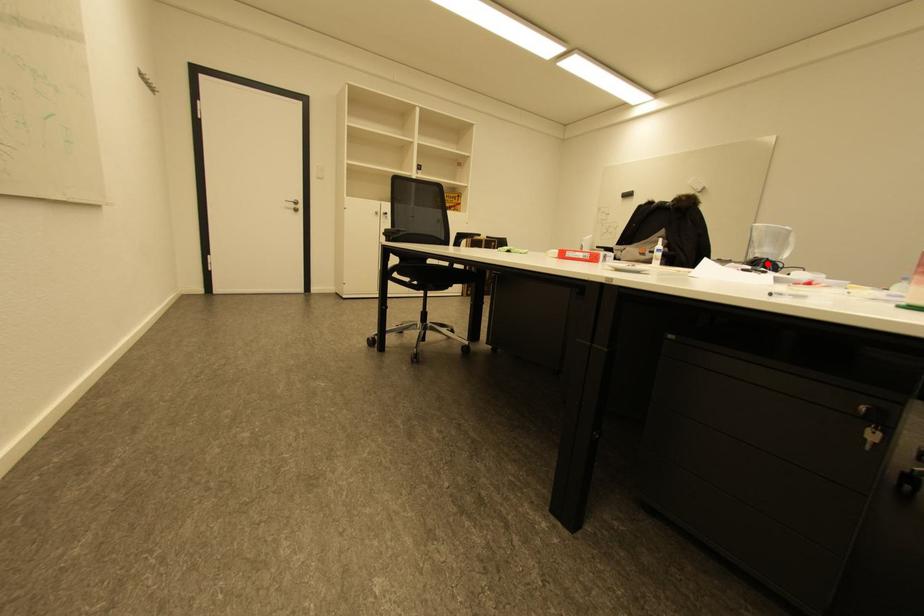
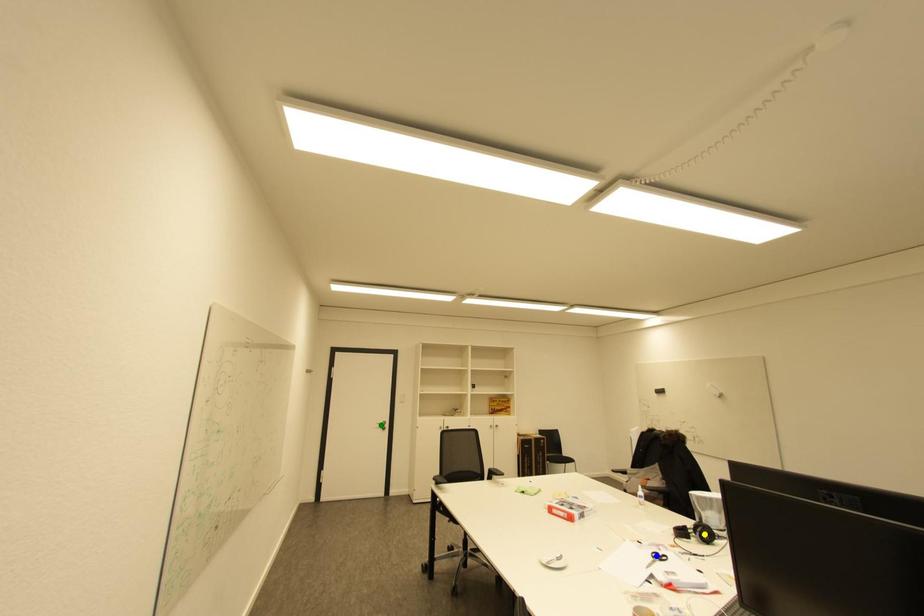
Question: I am providing you with two images of the same scene from different viewpoints. A red point is marked on the first image. You are given multiple points on the second image. In image 2, which mark is for the same physical point as the one in image 1?

Choices:
 (A) yellow point
 (B) blue point
 (C) green point

Answer: (A)